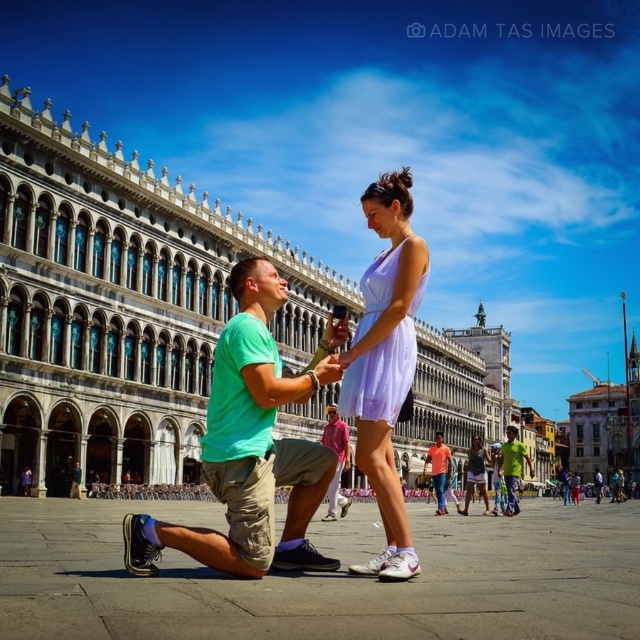
Question: Is green fabric shirt at center above matte purple dress at center?

Choices:
 (A) no
 (B) yes

Answer: (A)

Question: Does pink fabric shirt at center have a smaller size compared to green fabric shirt at center?

Choices:
 (A) yes
 (B) no

Answer: (A)

Question: Which of these objects is positioned closest to the pink fabric shirt at center?

Choices:
 (A) green fabric shirt at center
 (B) green matte t-shirt at center
 (C) lavender satin dress at center

Answer: (B)

Question: Is matte green t-shirt at center positioned in front of matte purple dress at center?

Choices:
 (A) yes
 (B) no

Answer: (B)

Question: Among these objects, which one is farthest from the camera?

Choices:
 (A) lavender satin dress at center
 (B) green fabric shirt at center
 (C) orange cotton shirt at center

Answer: (B)

Question: Which object is positioned farthest from the pink fabric shirt at center?

Choices:
 (A) green matte t-shirt at center
 (B) matte green t-shirt at center
 (C) green fabric shirt at center
 (D) matte purple dress at center

Answer: (C)